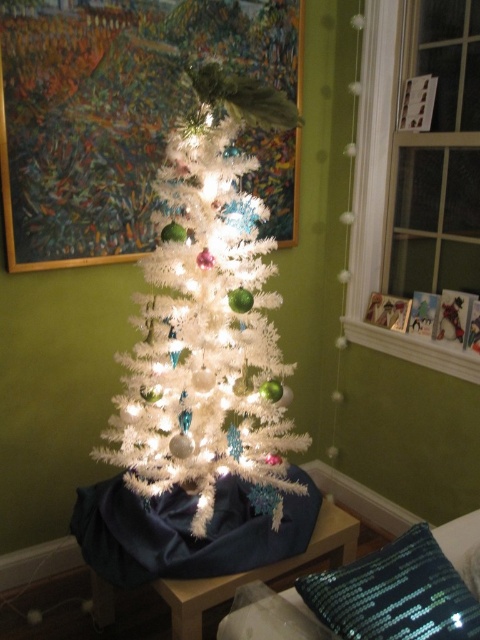
From the picture: You are decorating a room for a holiday party and want to ensure guests can see both the painted wood picture frame at upper center and the sparkly sequined pillow at lower right. Based on their positions, which object is closer to the viewer?

The painted wood picture frame at upper center is closer to the viewer because the sparkly sequined pillow at lower right is behind it.

You are standing in front of the white Christmas tree and notice a point marked at coordinates (x=112, y=112). Based on the scene description, can you identify what object this point is located on?

The point at (x=112, y=112) is located on the painted wood picture frame at upper center.

You are standing in the room and want to place a small gift between the two points, point (91,214) and point (399,556). Which point should the gift be closer to in order to be closer to you?

The gift should be closer to point (91,214) because it is closer to you than point (399,556).